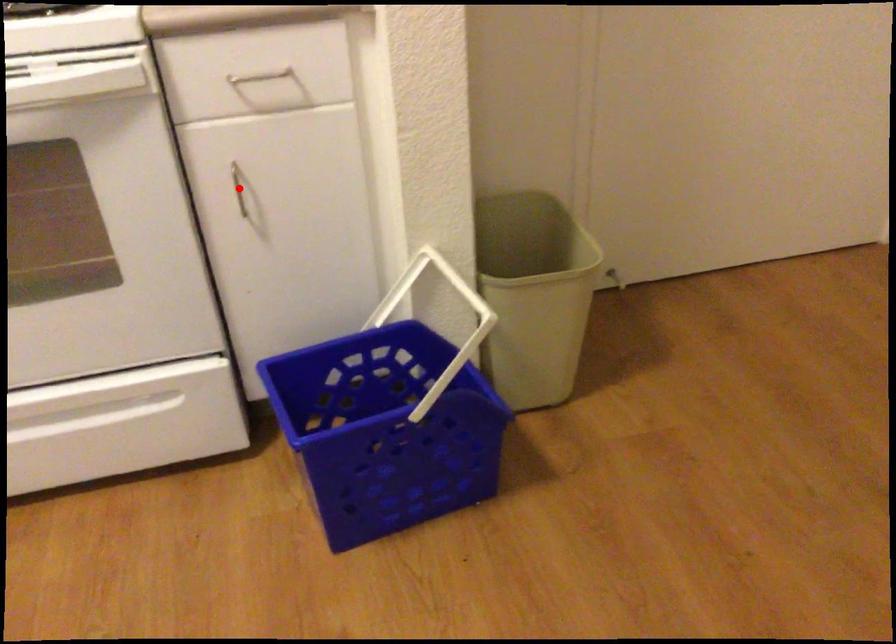
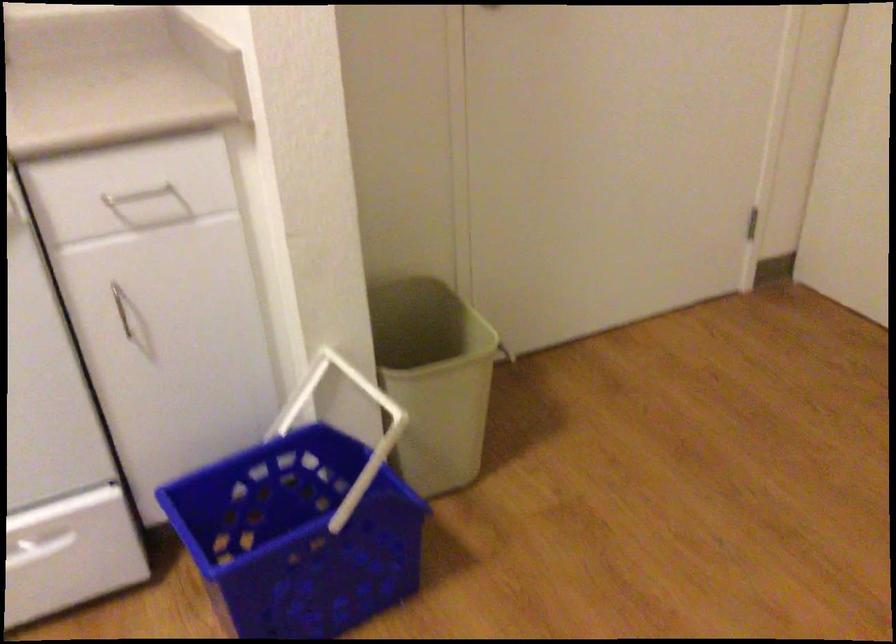
In the second image, find the point that corresponds to the highlighted location in the first image.

(121, 307)